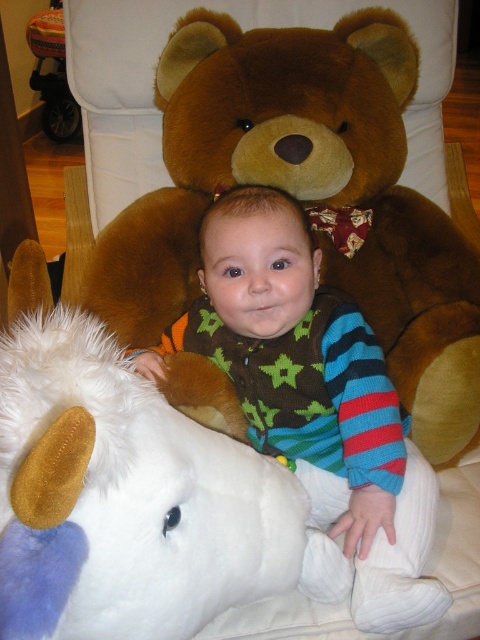
Can you confirm if white plush unicorn at lower left is thinner than multicolored knit sweater at center?

Correct, white plush unicorn at lower left's width is less than multicolored knit sweater at center's.

Does white plush unicorn at lower left appear on the left side of multicolored knit sweater at center?

Correct, you'll find white plush unicorn at lower left to the left of multicolored knit sweater at center.

Is point (71, 502) less distant than point (283, 436)?

Yes, point (71, 502) is in front of point (283, 436).

At what (x,y) coordinates should I click in order to perform the action: click on white plush unicorn at lower left. Please return your answer as a coordinate pair (x, y). Looking at the image, I should click on (124, 499).

Find the location of a particular element. The height and width of the screenshot is (640, 480). brown plush teddy bear at center is located at coordinates (305, 196).

Who is more distant from viewer, (122,272) or (132,490)?

Positioned behind is point (122,272).

Find the location of a particular element. This screenshot has height=640, width=480. brown plush teddy bear at center is located at coordinates (305, 196).

Between brown plush teddy bear at center and multicolored knit sweater at center, which one is positioned higher?

brown plush teddy bear at center is higher up.

Who is taller, brown plush teddy bear at center or multicolored knit sweater at center?

brown plush teddy bear at center

Is point (163, 129) positioned before point (307, 333)?

No, (163, 129) is further to viewer.

Identify the location of brown plush teddy bear at center. The image size is (480, 640). (305, 196).